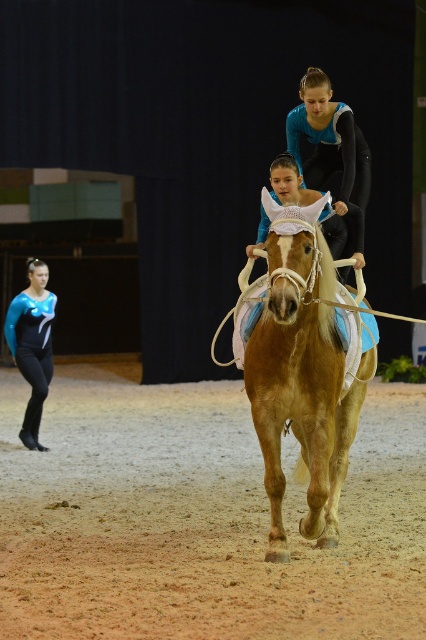
Does point (417, 488) lie in front of point (325, 168)?

No, (417, 488) is further to viewer.

Is brown sandy dirt track at lower center to the right of blue matte uniform at center from the viewer's perspective?

Incorrect, brown sandy dirt track at lower center is not on the right side of blue matte uniform at center.

Is point (83, 564) positioned before point (345, 113)?

Yes.

You are a GUI agent. You are given a task and a screenshot of the screen. Output one action in this format:
    pyautogui.click(x=<x>, y=<y>)
    Task: Click on the brown sandy dirt track at lower center
    
    Given the screenshot: What is the action you would take?
    pyautogui.click(x=198, y=518)

Is point (308, 104) more distant than point (31, 365)?

No, it is not.

Can you confirm if blue matte uniform at center is wider than matte blue leotard at lower left?

Yes, blue matte uniform at center is wider than matte blue leotard at lower left.

Which is in front, point (353, 118) or point (26, 442)?

Point (353, 118) is in front.

Identify the location of blue matte uniform at center. The image size is (426, 640). (333, 154).

Does light brown leather horse at center appear over matte blue leotard at lower left?

No, light brown leather horse at center is not above matte blue leotard at lower left.

Can you confirm if light brown leather horse at center is positioned below matte blue leotard at lower left?

Yes.

This screenshot has height=640, width=426. In order to click on light brown leather horse at center in this screenshot , I will do `click(302, 372)`.

Where is `light brown leather horse at center`? The height and width of the screenshot is (640, 426). light brown leather horse at center is located at coordinates (302, 372).